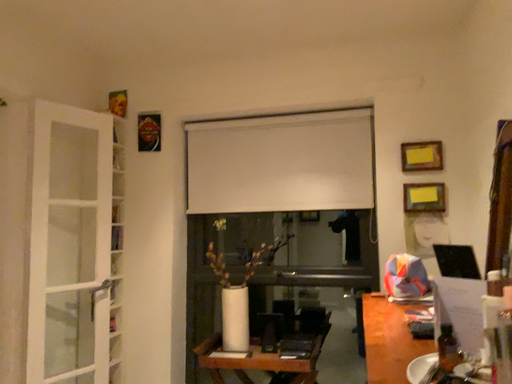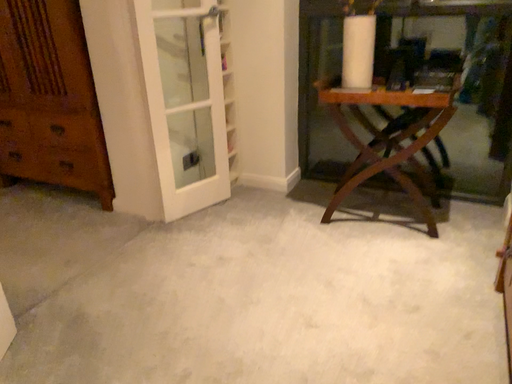
Question: How did the camera likely rotate when shooting the video?

Choices:
 (A) rotated upward
 (B) rotated downward

Answer: (B)